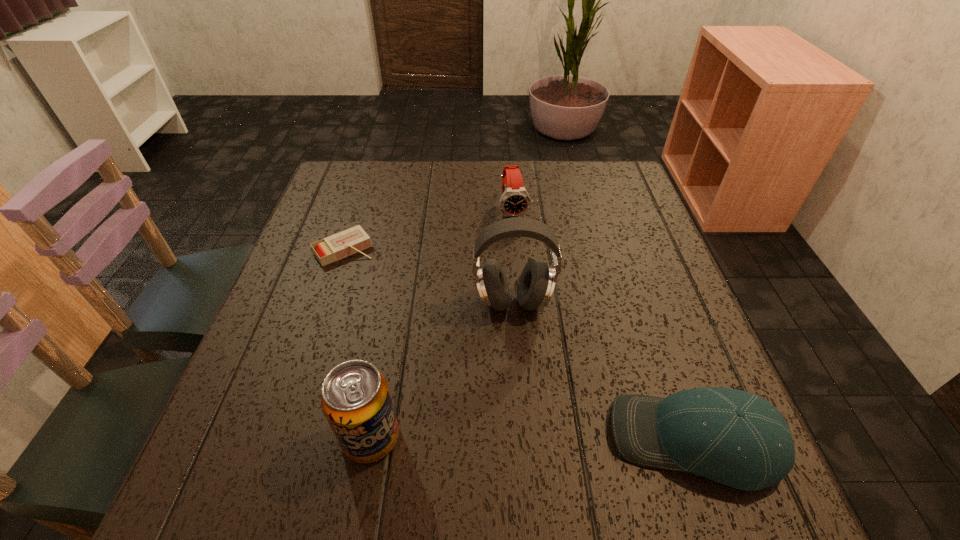
In order to click on empty space between the headset and the matchbox in this screenshot , I will do `click(429, 276)`.

What are the coordinates of `empty location between the third shortest object and the headset` in the screenshot? It's located at (514, 256).

Identify the location of free point between the third shortest object and the third farthest object. The image size is (960, 540). (514, 256).

You are a GUI agent. You are given a task and a screenshot of the screen. Output one action in this format:
    pyautogui.click(x=<x>, y=<y>)
    Task: Click on the closest object to the farthest object
    The height and width of the screenshot is (540, 960).
    Given the screenshot: What is the action you would take?
    pyautogui.click(x=537, y=281)

Locate which object ranks in proximity to the soda can. Please provide its 2D coordinates. Your answer should be formatted as a tuple, i.e. [(x, y)], where the tuple contains the x and y coordinates of a point satisfying the conditions above.

[(537, 281)]

Identify the location of free space that satisfies the following two spatial constraints: 1. on the front side of the soda can; 2. on the right side of the fourth nearest object. (282, 437).

At what (x,y) coordinates should I click in order to perform the action: click on vacant area in the image that satisfies the following two spatial constraints: 1. on the front side of the second tallest object; 2. on the left side of the rightmost object. Please return your answer as a coordinate pair (x, y). Image resolution: width=960 pixels, height=540 pixels. Looking at the image, I should click on (371, 441).

This screenshot has width=960, height=540. What are the coordinates of `blank space that satisfies the following two spatial constraints: 1. on the front side of the baseball cap; 2. on the right side of the second object from left to right` in the screenshot? It's located at (371, 441).